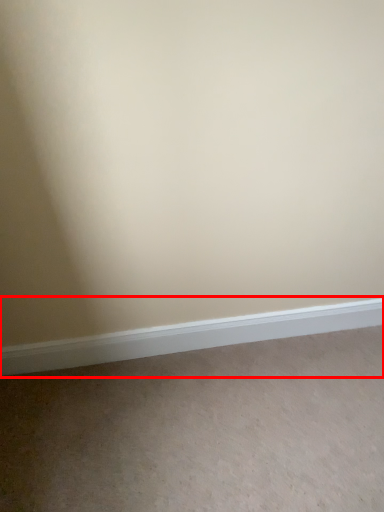
Question: Observing the image, what is the correct spatial positioning of window sill (annotated by the red box) in reference to plain?

Choices:
 (A) right
 (B) left

Answer: (B)